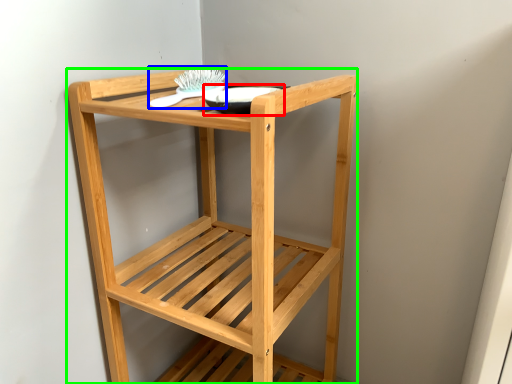
Question: Which object is positioned farthest from glass bowl (highlighted by a red box)? Select from brush (highlighted by a blue box) and furniture (highlighted by a green box).

Choices:
 (A) brush
 (B) furniture

Answer: (B)